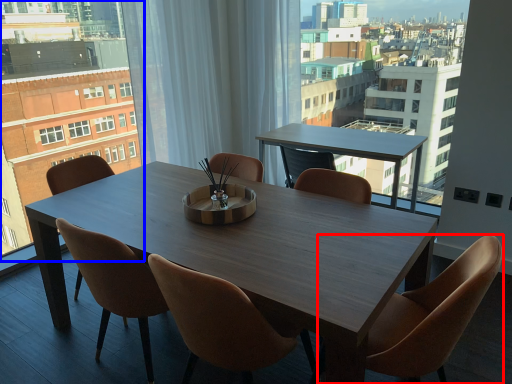
Question: Which of the following is the closest to the observer, chair (highlighted by a red box) or condominium (highlighted by a blue box)?

Choices:
 (A) chair
 (B) condominium

Answer: (A)